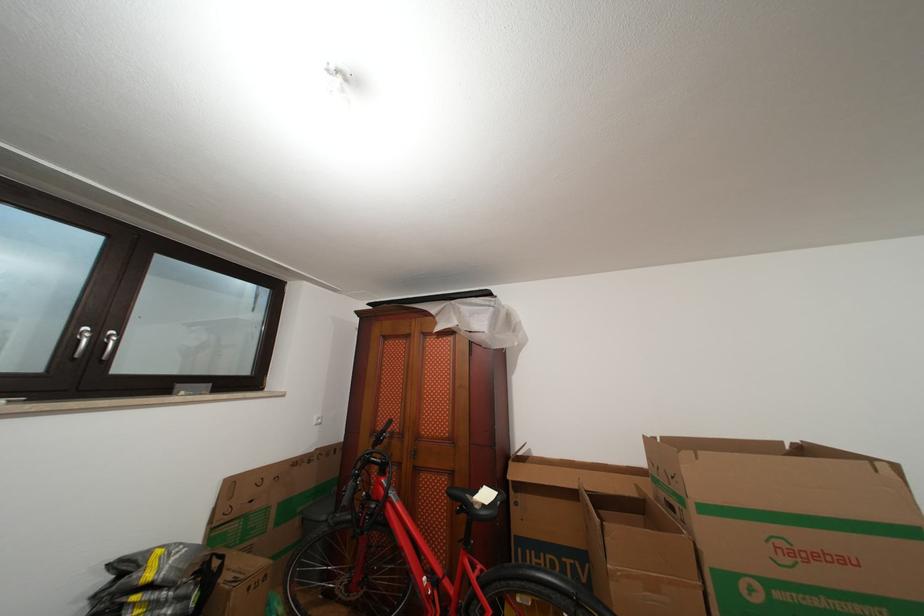
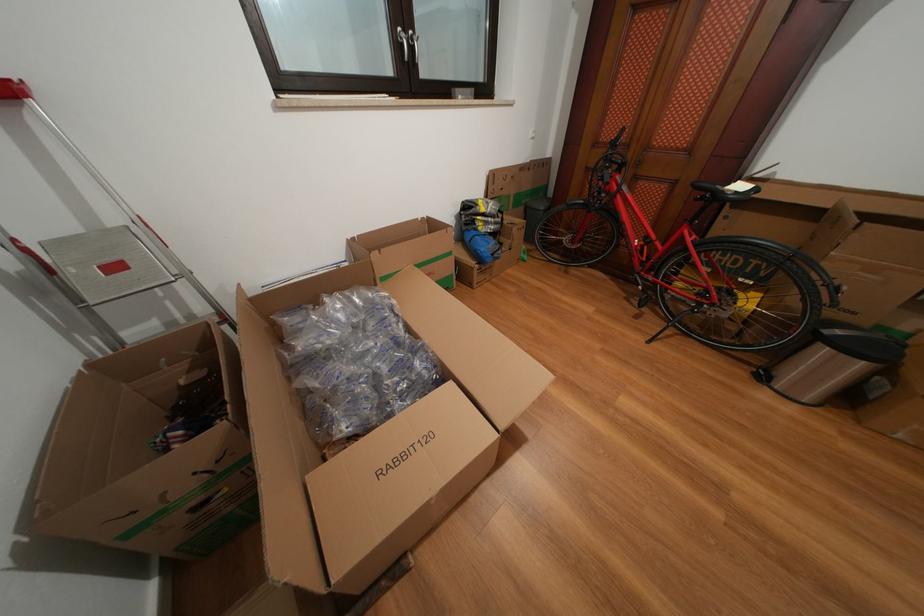
Locate, in the second image, the point that corresponds to the point at 388,431 in the first image.

(617, 140)